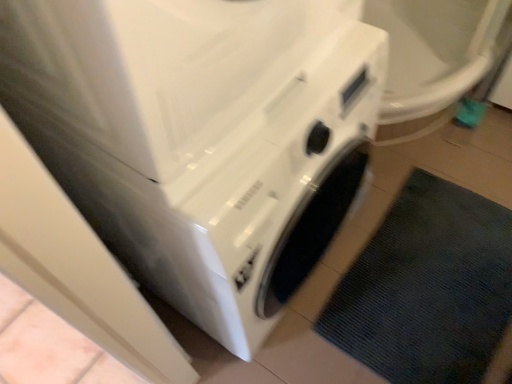
Question: Considering the positions of white glossy washing machine at center and dark gray textured bath mat at lower right in the image, is white glossy washing machine at center bigger or smaller than dark gray textured bath mat at lower right?

Choices:
 (A) big
 (B) small

Answer: (A)

Question: In terms of height, does white glossy washing machine at center look taller or shorter compared to dark gray textured bath mat at lower right?

Choices:
 (A) short
 (B) tall

Answer: (B)

Question: Is point click(92, 221) closer or farther from the camera than point click(488, 253)?

Choices:
 (A) farther
 (B) closer

Answer: (B)

Question: Is dark gray textured bath mat at lower right in front of or behind white glossy washing machine at center in the image?

Choices:
 (A) front
 (B) behind

Answer: (B)

Question: Is dark gray textured bath mat at lower right inside or outside of white glossy washing machine at center?

Choices:
 (A) inside
 (B) outside

Answer: (B)

Question: In the image, is dark gray textured bath mat at lower right on the left side or the right side of white glossy washing machine at center?

Choices:
 (A) right
 (B) left

Answer: (A)

Question: Does point (347, 334) appear closer or farther from the camera than point (154, 162)?

Choices:
 (A) closer
 (B) farther

Answer: (B)